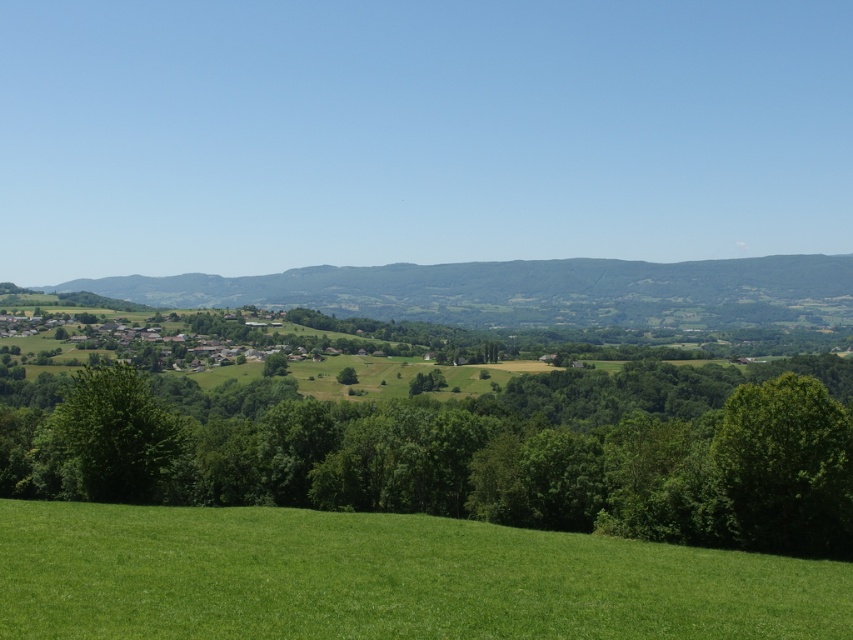
You are standing in the middle of the green field in the foreground. Looking towards the green leafy tree at center, which direction should you walk to reach it?

The green leafy tree at center is located at point coordinates of [473,456]. Since the tree is at the center, you should walk forward to reach it.

From the picture: You are standing in the middle of the green field in the foreground. You want to walk towards the green leafy tree at center. Which direction should you walk?

You should walk towards the center of the image where the green leafy tree at center is located, which is at coordinates point (473, 456).

You are standing at the center of the image and want to walk towards the green grassy field at lower center. In which direction should you move?

The green grassy field at lower center is located at point 0.905 on the x axis and 0.451 on the y axis. Since you are at the center of the image, which is point 0.5 on both axes, you should move towards the right and slightly downward to reach it.